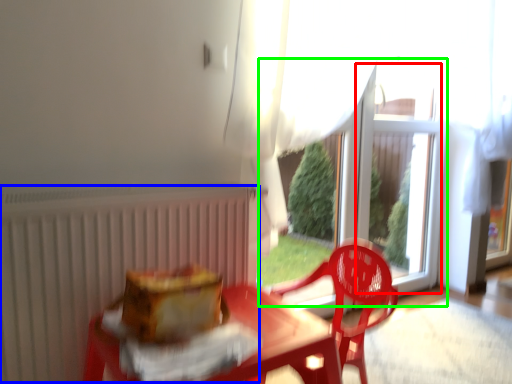
Question: Which object is the farthest from window screen (highlighted by a red box)? Choose among these: radiator (highlighted by a blue box) or glass door (highlighted by a green box).

Choices:
 (A) radiator
 (B) glass door

Answer: (A)